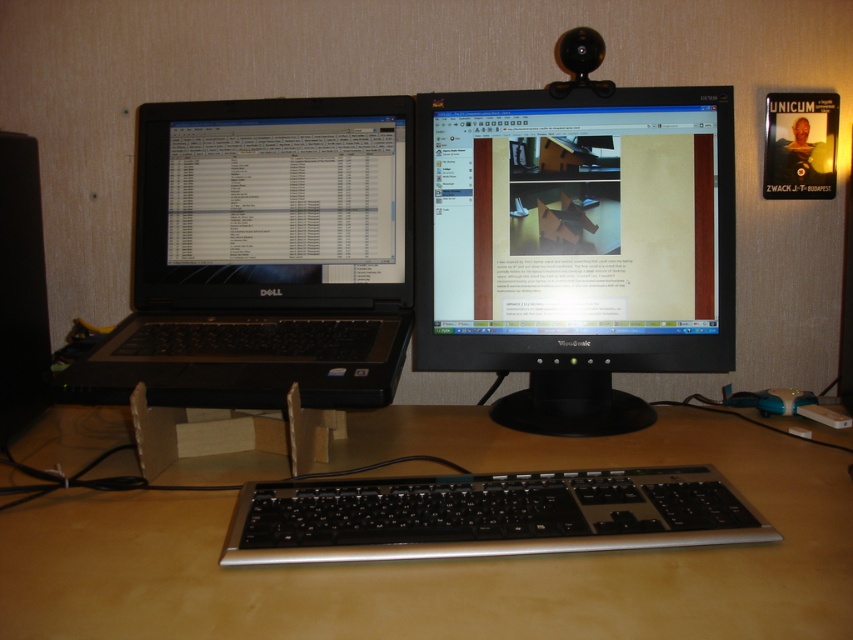
Is brown wood computer desk at center above black plastic keyboard at center?

Incorrect, brown wood computer desk at center is not positioned above black plastic keyboard at center.

Does point (685, 557) come farther from viewer compared to point (291, 538)?

No, it is not.

You are a GUI agent. You are given a task and a screenshot of the screen. Output one action in this format:
    pyautogui.click(x=<x>, y=<y>)
    Task: Click on the brown wood computer desk at center
    Image resolution: width=853 pixels, height=640 pixels.
    Given the screenshot: What is the action you would take?
    pyautogui.click(x=450, y=557)

At what (x,y) coordinates should I click in order to perform the action: click on brown wood computer desk at center. Please return your answer as a coordinate pair (x, y). Image resolution: width=853 pixels, height=640 pixels. Looking at the image, I should click on (450, 557).

Is point (451, 314) closer to viewer compared to point (379, 554)?

No, (451, 314) is further to viewer.

Which is more to the right, black glossy monitor at center or black plastic keyboard at center?

Positioned to the right is black glossy monitor at center.

The height and width of the screenshot is (640, 853). What do you see at coordinates (573, 244) in the screenshot?
I see `black glossy monitor at center` at bounding box center [573, 244].

Identify the location of black glossy monitor at center. The height and width of the screenshot is (640, 853). (573, 244).

Does black glossy monitor at center appear under black matte laptop at left?

Actually, black glossy monitor at center is above black matte laptop at left.

Can you confirm if black glossy monitor at center is smaller than black matte laptop at left?

Yes.

Find the location of a particular element. Image resolution: width=853 pixels, height=640 pixels. black glossy monitor at center is located at coordinates (573, 244).